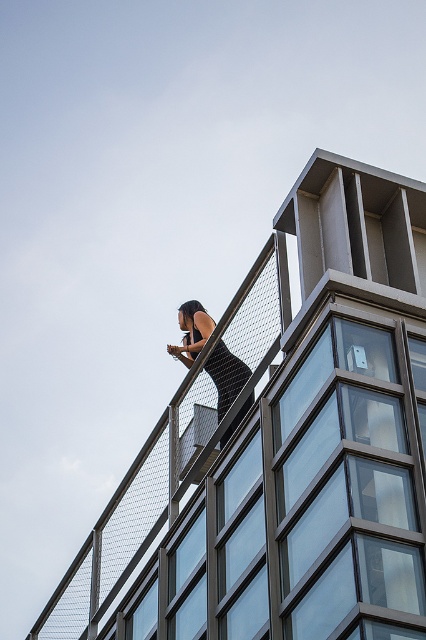
Can you confirm if metal mesh fence at upper center is shorter than black matte dress at upper center?

No.

Measure the distance from metal mesh fence at upper center to black matte dress at upper center.

The distance of metal mesh fence at upper center from black matte dress at upper center is 12.30 feet.

Is point (377, 371) behind point (178, 348)?

No, (377, 371) is closer to viewer.

What are the coordinates of `metal mesh fence at upper center` in the screenshot? It's located at (282, 445).